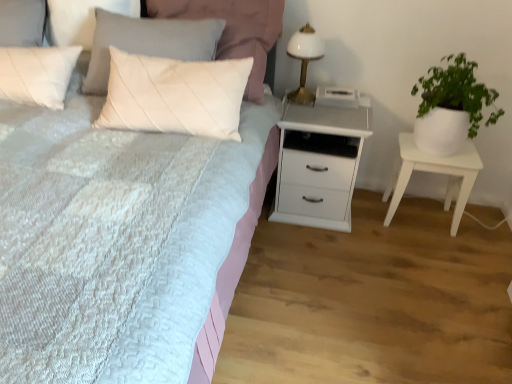
The image size is (512, 384). I want to click on free space between white wood chest of drawers at center and white matte nightstand at right, so click(380, 220).